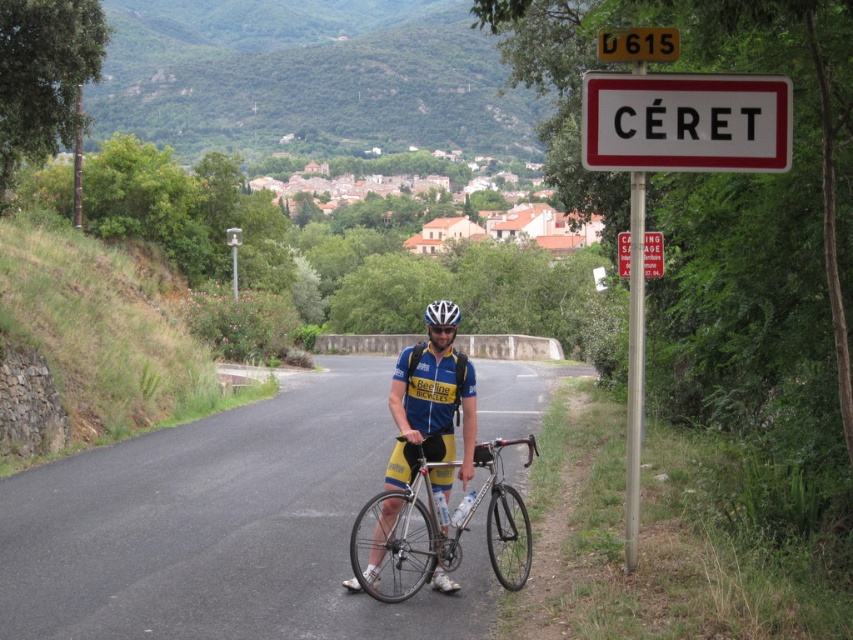
Question: Which point is closer to the camera?

Choices:
 (A) yellow/blue jersey at center
 (B) white matte bicycle helmet at center

Answer: (A)

Question: Can you confirm if silver metallic bicycle at center is thinner than white matte bicycle helmet at center?

Choices:
 (A) yes
 (B) no

Answer: (A)

Question: Can you confirm if metallic silver bicycle at center is positioned to the left of yellow/blue jersey at center?

Choices:
 (A) yes
 (B) no

Answer: (A)

Question: Which object appears closest to the camera in this image?

Choices:
 (A) white matte bicycle helmet at center
 (B) silver metallic bicycle at center

Answer: (B)

Question: Does metallic silver bicycle at center lie in front of yellow/blue jersey at center?

Choices:
 (A) yes
 (B) no

Answer: (A)

Question: Which object appears farthest from the camera in this image?

Choices:
 (A) white matte bicycle helmet at center
 (B) silver metallic bicycle at center

Answer: (A)